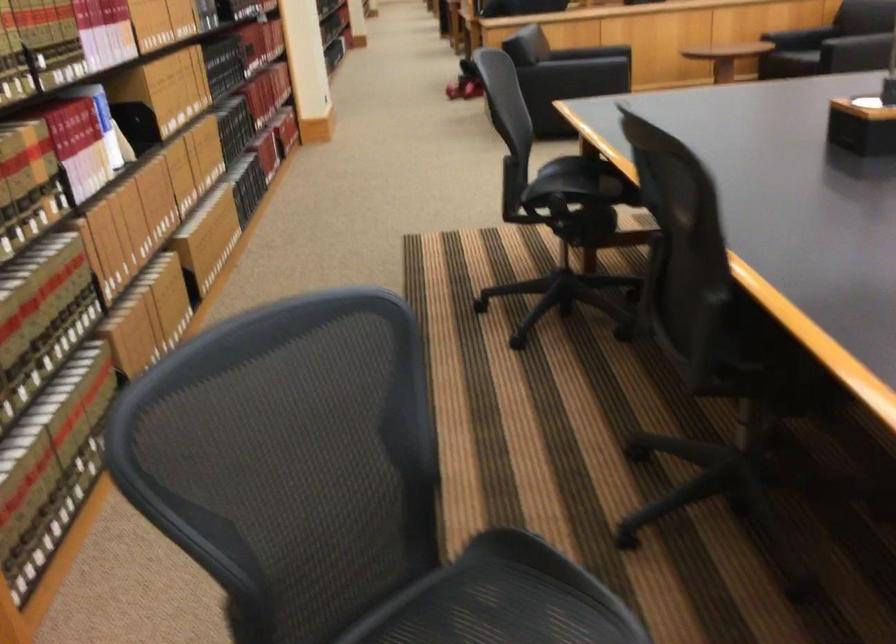
Which object does [862,126] point to?

It corresponds to the black square box in the image.